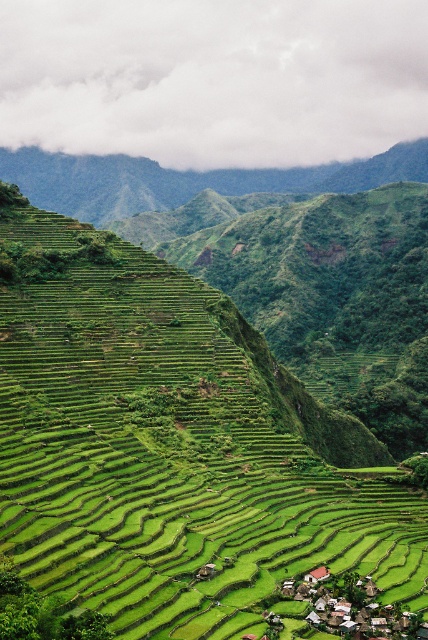
Is green grassy terraces at center smaller than white wooden houses at bottom right?

No.

Consider the image. Between green grassy terraces at center and white wooden houses at bottom right, which one has less height?

Standing shorter between the two is white wooden houses at bottom right.

Who is more forward, (246,410) or (422,586)?

Point (422,586) is more forward.

Where is `green grassy terraces at center`? The width and height of the screenshot is (428, 640). green grassy terraces at center is located at coordinates (175, 451).